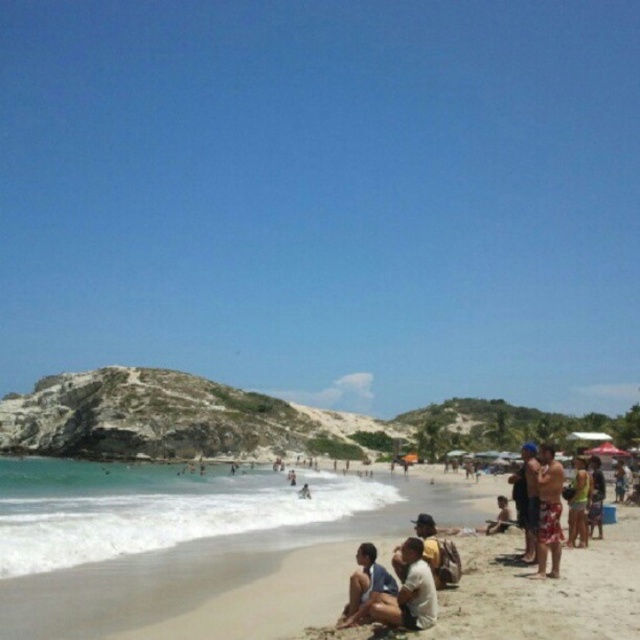
How distant is beige sand beach at lower center from green fabric shorts at lower right?

The distance of beige sand beach at lower center from green fabric shorts at lower right is 33.58 meters.

Locate an element on the screen. The image size is (640, 640). beige sand beach at lower center is located at coordinates (196, 552).

Who is positioned more to the right, clear blue water at lower left or matte white shirt at lower center?

Positioned to the right is matte white shirt at lower center.

Between point (173, 470) and point (412, 556), which one is positioned behind?

Positioned behind is point (173, 470).

In order to click on clear blue water at lower left in this screenshot , I will do `click(154, 508)`.

Who is more distant from viewer, (x=420, y=529) or (x=595, y=506)?

The point (x=595, y=506) is more distant.

Is point (394, 556) farther from camera compared to point (600, 524)?

No, (394, 556) is closer to viewer.

Between point (413, 524) and point (596, 493), which one is positioned in front?

Point (596, 493) is in front.

Locate an element on the screen. yellow fabric hat at lower center is located at coordinates (436, 552).